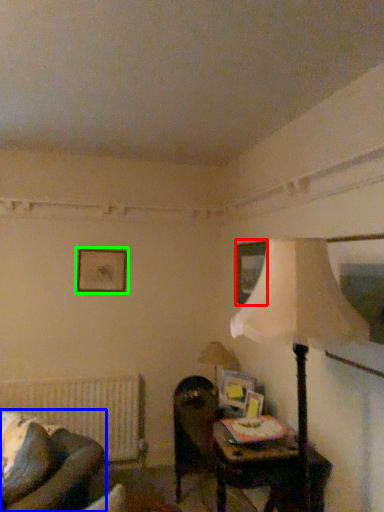
Question: Considering the real-world distances, which object is farthest from picture frame (highlighted by a red box)? rocking chair (highlighted by a blue box) or picture frame (highlighted by a green box)?

Choices:
 (A) rocking chair
 (B) picture frame

Answer: (A)